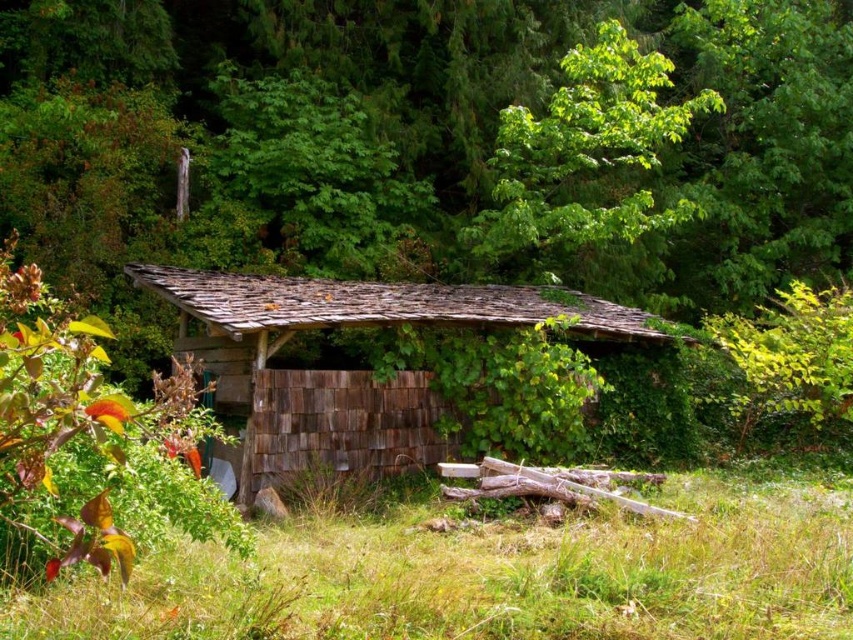
Question: Observing the image, what is the correct spatial positioning of green grass at lower center in reference to weathered wood hut at center?

Choices:
 (A) left
 (B) right

Answer: (A)

Question: Which object is the farthest from the green grass at lower center?

Choices:
 (A) weathered wood hut at center
 (B) green leafy tree at upper center

Answer: (B)

Question: Does weathered wood hut at center appear over green leafy tree at upper center?

Choices:
 (A) yes
 (B) no

Answer: (B)

Question: Which of the following is the farthest from the observer?

Choices:
 (A) (630, 323)
 (B) (596, 90)

Answer: (B)

Question: Which of the following is the farthest from the observer?

Choices:
 (A) (647, 106)
 (B) (276, 582)
 (C) (231, 305)

Answer: (A)

Question: Considering the relative positions of weathered wood hut at center and green leafy tree at upper center in the image provided, where is weathered wood hut at center located with respect to green leafy tree at upper center?

Choices:
 (A) left
 (B) right

Answer: (A)